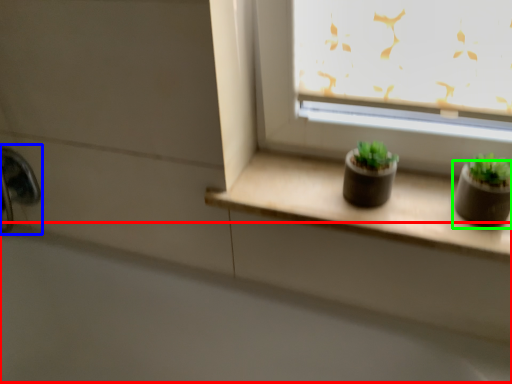
Question: Which object is positioned closest to bath (highlighted by a red box)? Select from faucet (highlighted by a blue box) and flowerpot (highlighted by a green box).

Choices:
 (A) faucet
 (B) flowerpot

Answer: (A)